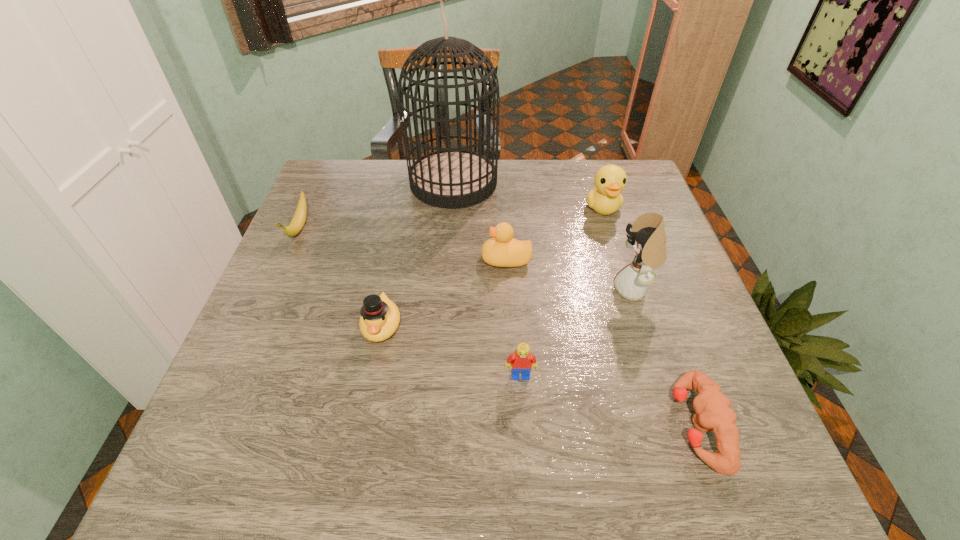
At what (x,y) coordinates should I click in order to perform the action: click on object that ranks as the closest to the leftmost duck. Please return your answer as a coordinate pair (x, y). Image resolution: width=960 pixels, height=540 pixels. Looking at the image, I should click on (502, 250).

Point out which duck is positioned as the nearest to the banana. Please provide its 2D coordinates. Your answer should be formatted as a tuple, i.e. [(x, y)], where the tuple contains the x and y coordinates of a point satisfying the conditions above.

[(380, 317)]

Locate which duck ranks third in proximity to the Lego. Please provide its 2D coordinates. Your answer should be formatted as a tuple, i.e. [(x, y)], where the tuple contains the x and y coordinates of a point satisfying the conditions above.

[(605, 198)]

What are the coordinates of `vacant region that satisfies the following two spatial constraints: 1. on the face of the rightmost duck; 2. on the face of the second nearest duck` in the screenshot? It's located at (619, 259).

I want to click on free location that satisfies the following two spatial constraints: 1. at the front face of the second tallest object; 2. on the front-facing side of the nearest duck, so click(x=645, y=326).

Image resolution: width=960 pixels, height=540 pixels. I want to click on free space that satisfies the following two spatial constraints: 1. on the face of the farthest duck; 2. on the face of the second nearest duck, so pos(619,259).

You are a GUI agent. You are given a task and a screenshot of the screen. Output one action in this format:
    pyautogui.click(x=<x>, y=<y>)
    Task: Click on the free point that satisfies the following two spatial constraints: 1. at the front face of the doll; 2. on the face of the Lego
    This screenshot has height=540, width=960.
    Given the screenshot: What is the action you would take?
    pyautogui.click(x=661, y=375)